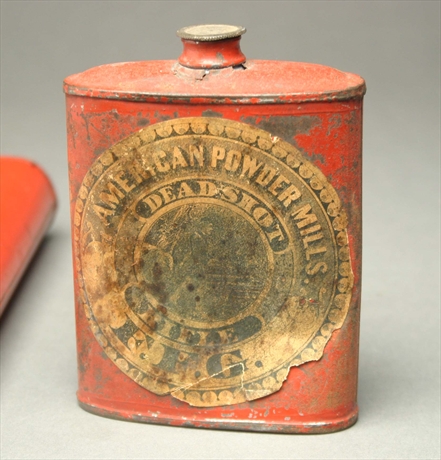
Where is `white surface`? Image resolution: width=441 pixels, height=460 pixels. white surface is located at coordinates (387, 330).